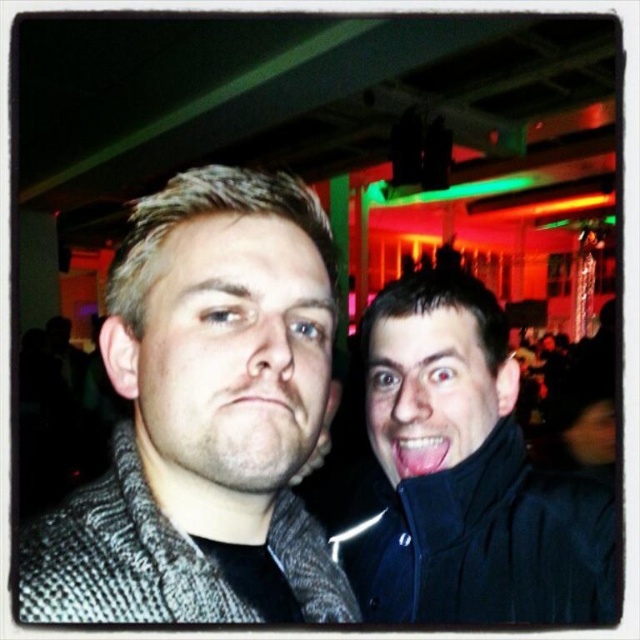
Question: Does matte gray coat at center have a larger size compared to pink matte lips at center?

Choices:
 (A) no
 (B) yes

Answer: (B)

Question: Which object appears closest to the camera in this image?

Choices:
 (A) pink matte lips at center
 (B) matte gray coat at center

Answer: (B)

Question: Among these objects, which one is nearest to the camera?

Choices:
 (A) black matte jacket at right
 (B) pink matte lips at center

Answer: (B)

Question: Where is matte gray coat at center located in relation to pink glossy tongue at right in the image?

Choices:
 (A) below
 (B) above

Answer: (B)

Question: Can you confirm if black matte jacket at right is smaller than pink glossy tongue at right?

Choices:
 (A) yes
 (B) no

Answer: (B)

Question: Among these points, which one is farthest from the camera?

Choices:
 (A) (416, 584)
 (B) (269, 483)
 (C) (268, 392)
 (D) (445, 408)

Answer: (A)